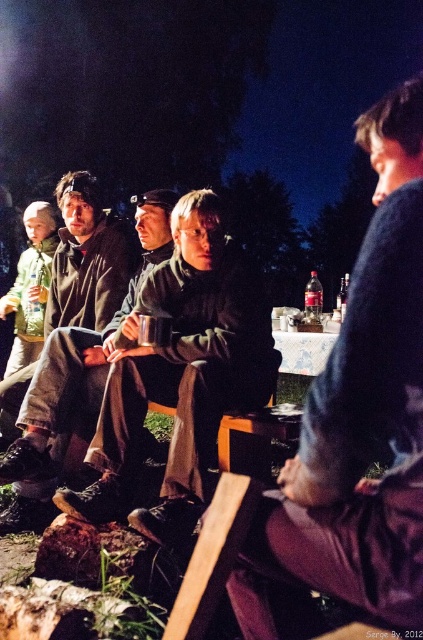
Question: Which point is closer to the camera taking this photo?

Choices:
 (A) (384, 317)
 (B) (41, 488)

Answer: (A)

Question: Can you confirm if dark blue sweater at upper right is wider than dark brown leather jacket at center?

Choices:
 (A) yes
 (B) no

Answer: (B)

Question: Is the position of dark blue sweater at upper right more distant than that of dark green fabric jacket at center?

Choices:
 (A) no
 (B) yes

Answer: (A)

Question: Can you confirm if dark blue sweater at upper right is smaller than dark brown leather jacket at center?

Choices:
 (A) no
 (B) yes

Answer: (B)

Question: Considering the real-world distances, which object is farthest from the dark brown leather jacket at center?

Choices:
 (A) dark blue sweater at upper right
 (B) dark green fabric jacket at center

Answer: (A)

Question: Considering the real-world distances, which object is closest to the dark blue sweater at upper right?

Choices:
 (A) dark green fabric jacket at center
 (B) dark brown leather jacket at center

Answer: (A)